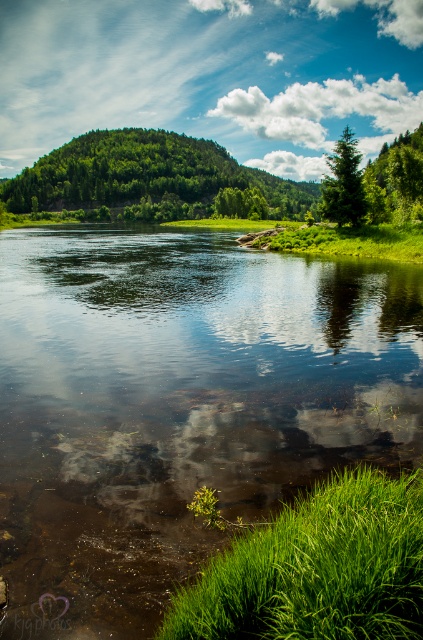
You are a hiker standing at the edge of the river and want to reach the green matte tree at upper right. Which direction should you head towards from the green grass at lower right?

The green grass at lower right is to the left of the green matte tree at upper right, so you should head towards the right to reach the green matte tree at upper right from the green grass at lower right.

You are standing at the center of the image and want to walk to the green grass at lower right. Based on the coordinates provided, in which direction should you move?

The green grass at lower right is located at coordinates point (316, 568), so you should move towards the lower right direction to reach it.

You are a bird looking for a nesting spot. You see both the green leafy tree at upper right and the green matte tree at upper right. Which tree is taller and would provide a better vantage point?

The green leafy tree at upper right is taller than the green matte tree at upper right, so it would provide a better vantage point for nesting.